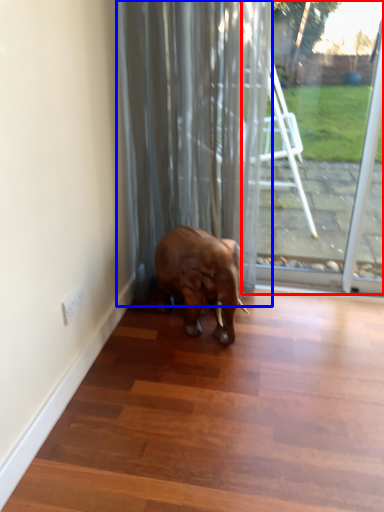
Question: Which object is closer to the camera taking this photo, glass door (highlighted by a red box) or curtain (highlighted by a blue box)?

Choices:
 (A) glass door
 (B) curtain

Answer: (B)